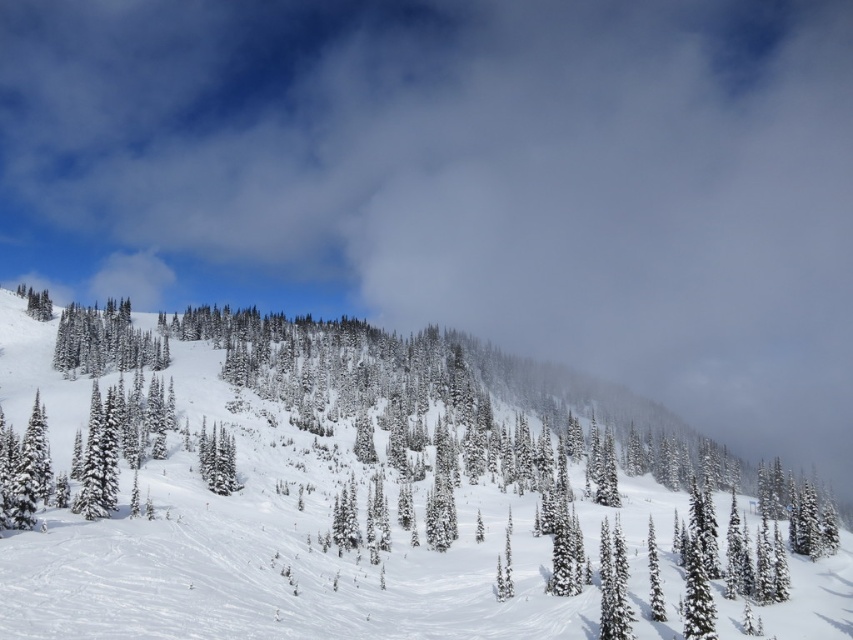
You are standing at the point marked as point (315,497) in the winter landscape. What terrain feature are you currently standing on?

You are standing on white fluffy snow at center, as the point (315,497) is located there.